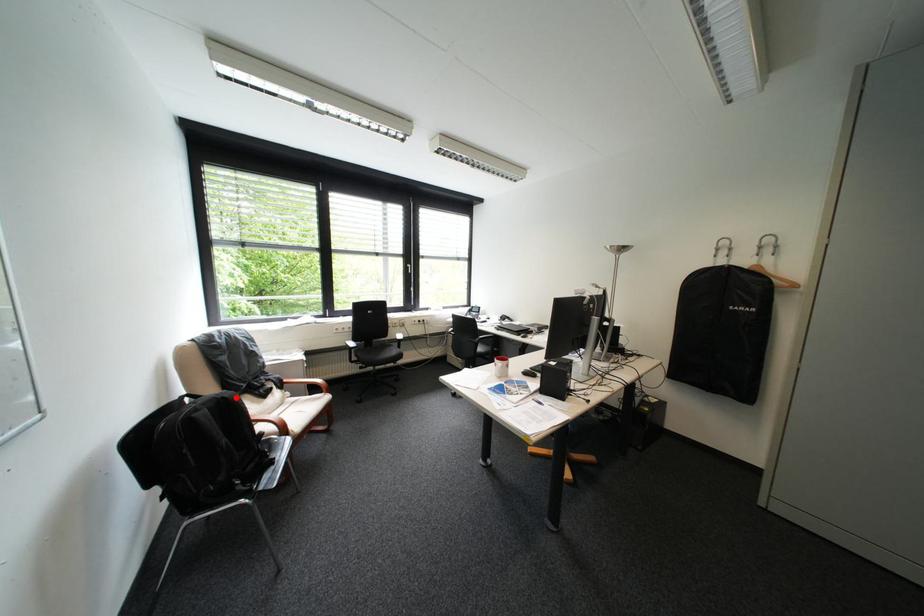
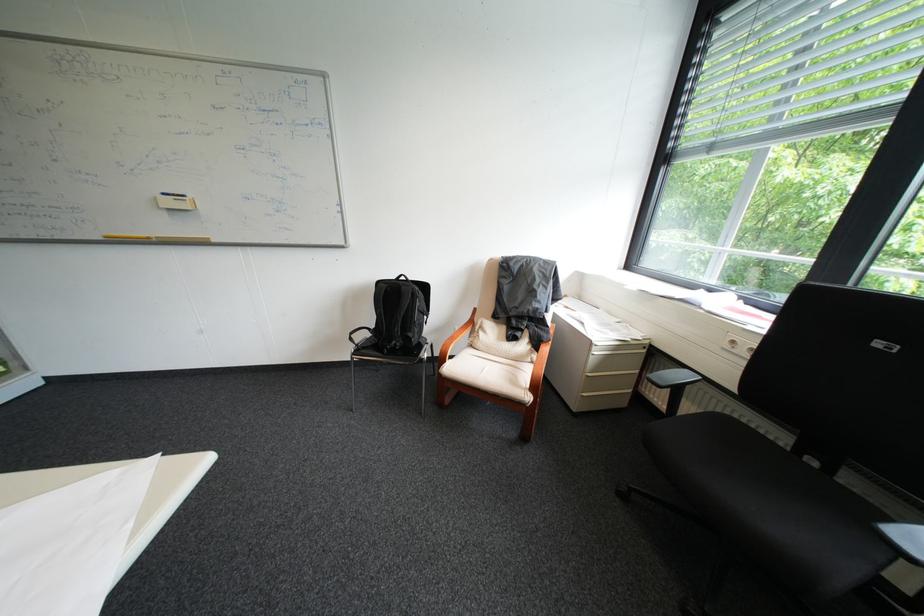
Where in the second image is the point corresponding to the highlighted location from the first image?

(415, 288)